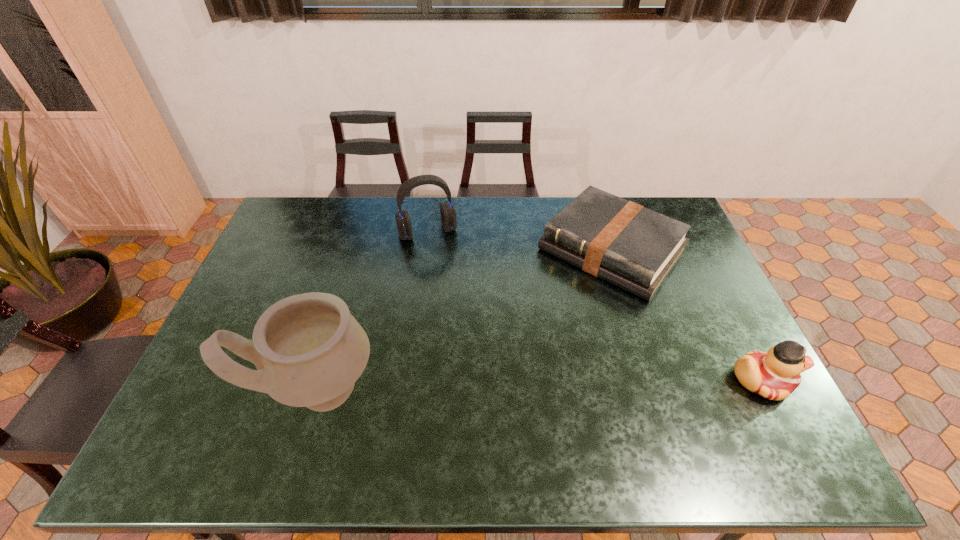
Where is `vacant point located between the second shortest object and the headset`? This screenshot has width=960, height=540. vacant point located between the second shortest object and the headset is located at coordinates (594, 306).

Locate an element on the screen. The height and width of the screenshot is (540, 960). unoccupied position between the headset and the pottery is located at coordinates tap(372, 310).

Locate an element on the screen. This screenshot has width=960, height=540. free space between the second tallest object and the shortest object is located at coordinates (519, 241).

I want to click on vacant space that's between the tallest object and the third tallest object, so click(x=540, y=384).

Find the location of a particular element. The width and height of the screenshot is (960, 540). vacant point located between the third shortest object and the third tallest object is located at coordinates (594, 306).

Select which object appears as the closest to the duck. Please provide its 2D coordinates. Your answer should be formatted as a tuple, i.e. [(x, y)], where the tuple contains the x and y coordinates of a point satisfying the conditions above.

[(630, 246)]

Select which object appears as the third closest to the third tallest object. Please provide its 2D coordinates. Your answer should be formatted as a tuple, i.e. [(x, y)], where the tuple contains the x and y coordinates of a point satisfying the conditions above.

[(309, 351)]

Where is `vacant space that satisfies the following two spatial constraints: 1. on the front side of the duck; 2. on the face of the shortest object`? Image resolution: width=960 pixels, height=540 pixels. vacant space that satisfies the following two spatial constraints: 1. on the front side of the duck; 2. on the face of the shortest object is located at coordinates (653, 381).

Where is `free space in the image that satisfies the following two spatial constraints: 1. on the back side of the third tallest object; 2. on the face of the pottery`? The height and width of the screenshot is (540, 960). free space in the image that satisfies the following two spatial constraints: 1. on the back side of the third tallest object; 2. on the face of the pottery is located at coordinates pos(321,381).

Find the location of a particular element. The width and height of the screenshot is (960, 540). vacant space that satisfies the following two spatial constraints: 1. on the front side of the hardback book; 2. on the face of the second shortest object is located at coordinates (653, 381).